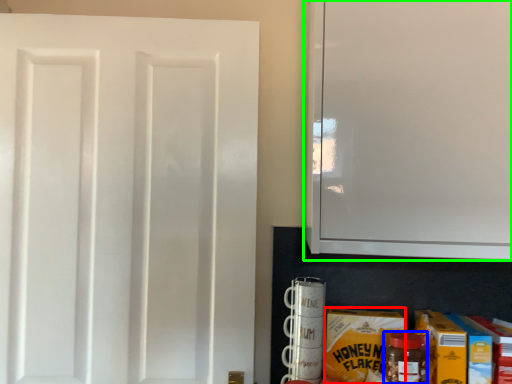
Question: Which object is the closest to the carton (highlighted by a red box)? Choose among these: bottle (highlighted by a blue box) or cabinetry (highlighted by a green box).

Choices:
 (A) bottle
 (B) cabinetry

Answer: (A)